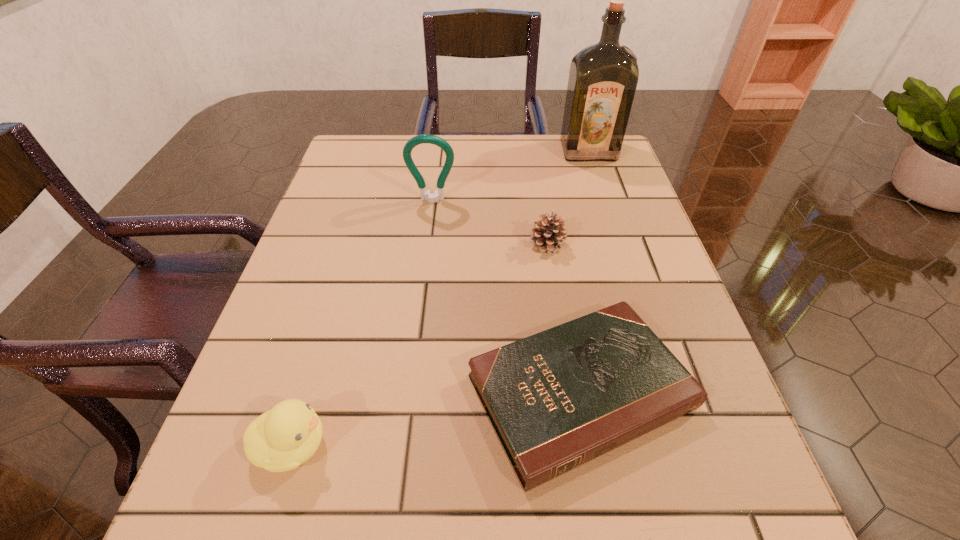
At what (x,y) coordinates should I click in order to perform the action: click on the tallest object. Please return your answer as a coordinate pair (x, y). Image resolution: width=960 pixels, height=540 pixels. Looking at the image, I should click on (603, 77).

Image resolution: width=960 pixels, height=540 pixels. I want to click on liquor, so click(x=603, y=77).

This screenshot has width=960, height=540. In order to click on the fourth object from right to left in this screenshot , I will do `click(438, 194)`.

Locate an element on the screen. bottle opener is located at coordinates (438, 194).

Locate an element on the screen. The height and width of the screenshot is (540, 960). duckling is located at coordinates (281, 439).

At what (x,y) coordinates should I click in order to perform the action: click on the second shortest object. Please return your answer as a coordinate pair (x, y). Looking at the image, I should click on (546, 235).

The image size is (960, 540). I want to click on the third farthest object, so click(x=546, y=235).

Locate an element on the screen. Image resolution: width=960 pixels, height=540 pixels. the shortest object is located at coordinates (558, 399).

The height and width of the screenshot is (540, 960). What are the coordinates of `free space located 0.170m on the label of the farthest object` in the screenshot? It's located at (606, 202).

Where is `free region located 0.320m at the jaws of the bottle opener`? The height and width of the screenshot is (540, 960). free region located 0.320m at the jaws of the bottle opener is located at coordinates (418, 315).